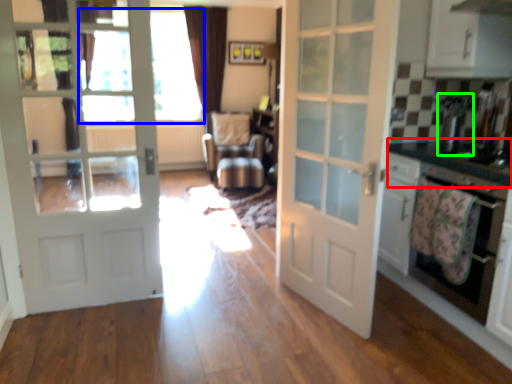
Question: Which is farther away from counter top (highlighted by a red box)? window screen (highlighted by a blue box) or appliance (highlighted by a green box)?

Choices:
 (A) window screen
 (B) appliance

Answer: (A)